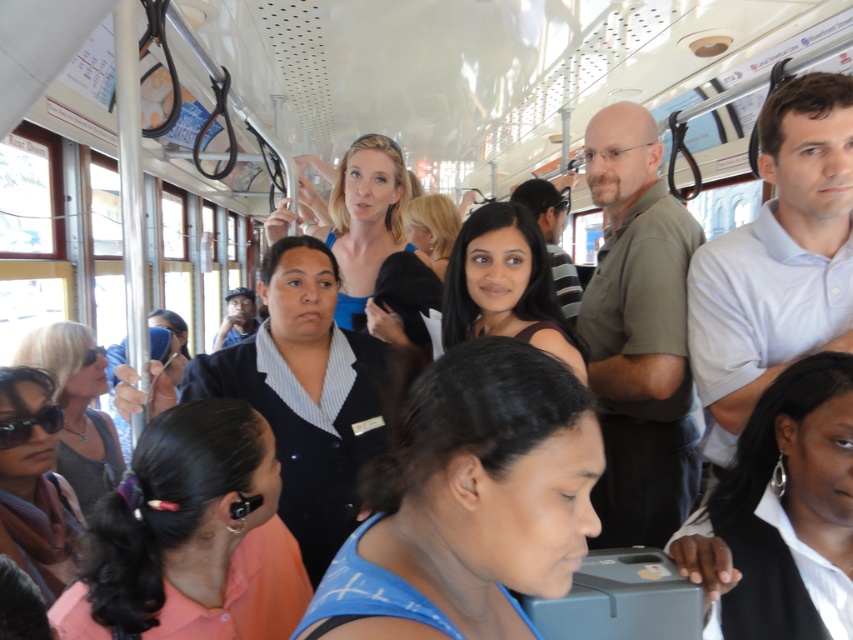
Is pink fabric earbud at lower left closer to camera compared to green matte shirt at center?

That is True.

Is pink fabric earbud at lower left thinner than green matte shirt at center?

In fact, pink fabric earbud at lower left might be wider than green matte shirt at center.

What do you see at coordinates (190, 538) in the screenshot? Image resolution: width=853 pixels, height=640 pixels. I see `pink fabric earbud at lower left` at bounding box center [190, 538].

The width and height of the screenshot is (853, 640). What are the coordinates of `pink fabric earbud at lower left` in the screenshot? It's located at (190, 538).

Is white striped polo shirt at center bigger than white glossy earpiece at center?

Yes.

Does white striped polo shirt at center have a lesser height compared to white glossy earpiece at center?

In fact, white striped polo shirt at center may be taller than white glossy earpiece at center.

You are a GUI agent. You are given a task and a screenshot of the screen. Output one action in this format:
    pyautogui.click(x=<x>, y=<y>)
    Task: Click on the white striped polo shirt at center
    The width and height of the screenshot is (853, 640).
    Given the screenshot: What is the action you would take?
    pyautogui.click(x=776, y=260)

Consider the image. Is pink fabric earbud at lower left to the right of dark brown hair at center from the viewer's perspective?

Incorrect, pink fabric earbud at lower left is not on the right side of dark brown hair at center.

In the scene shown: Is pink fabric earbud at lower left below dark brown hair at center?

Indeed, pink fabric earbud at lower left is positioned under dark brown hair at center.

The width and height of the screenshot is (853, 640). What do you see at coordinates (190, 538) in the screenshot? I see `pink fabric earbud at lower left` at bounding box center [190, 538].

You are a GUI agent. You are given a task and a screenshot of the screen. Output one action in this format:
    pyautogui.click(x=<x>, y=<y>)
    Task: Click on the pink fabric earbud at lower left
    This screenshot has height=640, width=853.
    Given the screenshot: What is the action you would take?
    pyautogui.click(x=190, y=538)